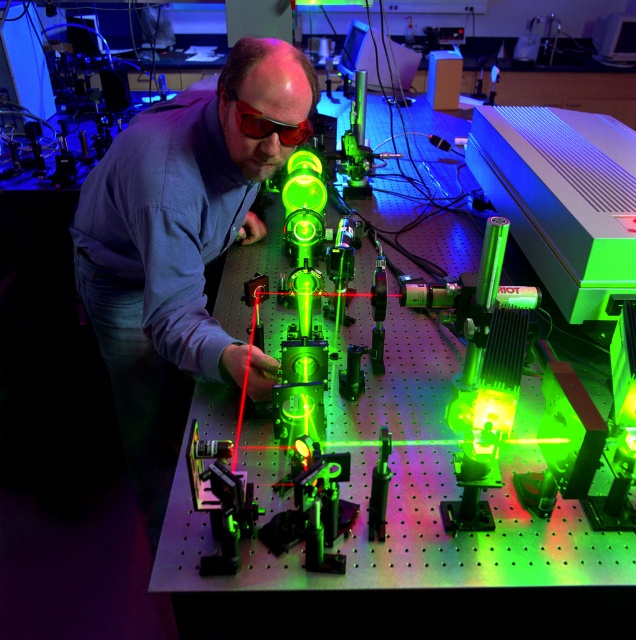
Locate an element on the screen. The image size is (636, 640). matte black shirt at center is located at coordinates (177, 248).

Can you confirm if matte black shirt at center is smaller than red plastic glasses at center?

No, matte black shirt at center is not smaller than red plastic glasses at center.

Does point (221, 122) come in front of point (310, 124)?

Yes, point (221, 122) is closer to viewer.

Locate an element on the screen. The height and width of the screenshot is (640, 636). matte black shirt at center is located at coordinates (177, 248).